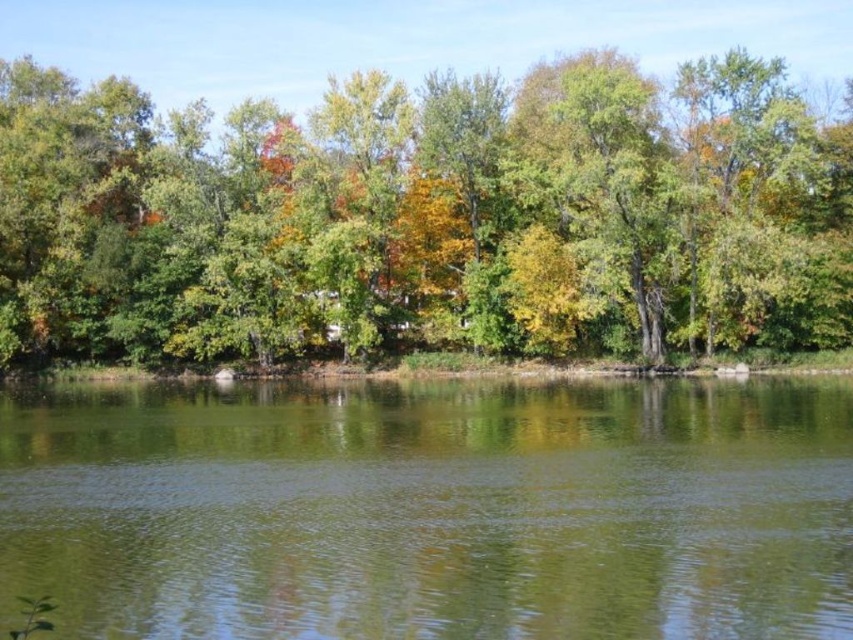
You are standing at the edge of the water in the scene. You see a green matte tree at center marked by point (425,218). If you walk straight ahead, will you reach the green matte tree at center before the water ends?

The green matte tree at center is represented by point (425,218), so yes, walking straight ahead from the water edge, you will reach the green matte tree at center before the water ends because the point indicates its position in front of you.

You are standing at the edge of the water and want to find the green matte tree at center. Based on the coordinates provided, in which direction should you look to locate it?

The green matte tree at center is located at coordinates point (425, 218). Since the coordinate system is not specified, but assuming standard image coordinates where the origin is at the bottom left corner, the tree is positioned slightly to the right of the center horizontally and near the center vertically. Therefore, you should look towards the middle of the image, slightly to the right to locate the green matte tree at center.